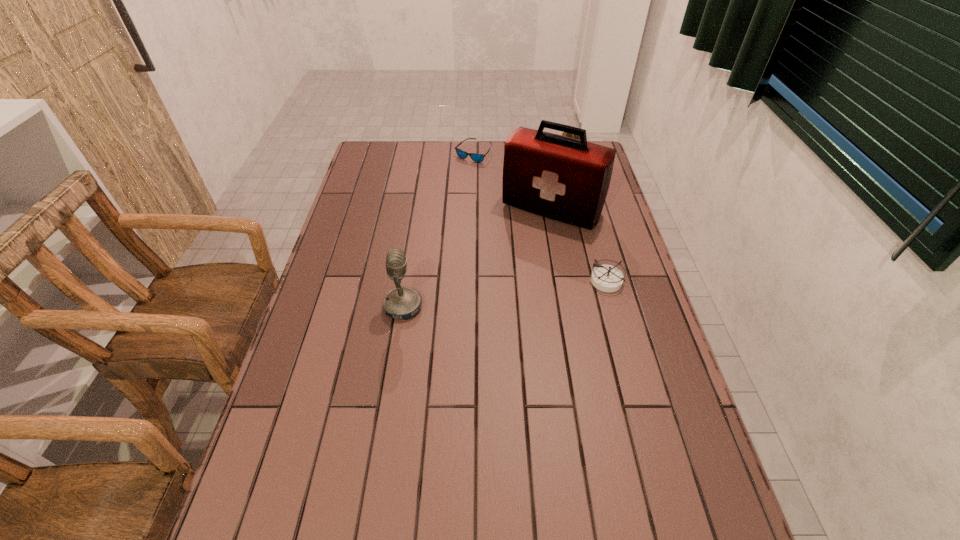
Identify the location of the fourth shortest object. The image size is (960, 540). (401, 302).

Image resolution: width=960 pixels, height=540 pixels. Identify the location of the leftmost object. (401, 302).

Find the location of `the second shortest object`. the second shortest object is located at coordinates (606, 278).

Find the location of a particular element. The image size is (960, 540). the nearer compass is located at coordinates (606, 278).

Locate an element on the screen. This screenshot has width=960, height=540. the second object from left to right is located at coordinates (475, 157).

You are a GUI agent. You are given a task and a screenshot of the screen. Output one action in this format:
    pyautogui.click(x=<x>, y=<y>)
    Task: Click on the sunglasses
    
    Given the screenshot: What is the action you would take?
    pyautogui.click(x=475, y=157)

The image size is (960, 540). Find the location of `the tallest object`. the tallest object is located at coordinates (562, 178).

Locate an element on the screen. The height and width of the screenshot is (540, 960). the third nearest object is located at coordinates (562, 178).

Identify the location of the farther compass. (564, 133).

Locate an element on the screen. the taller compass is located at coordinates (564, 133).